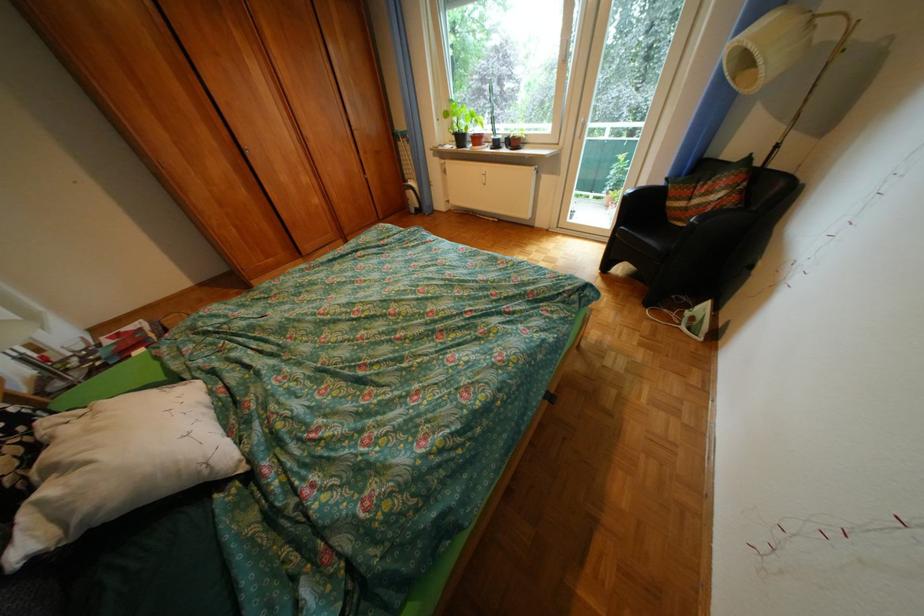
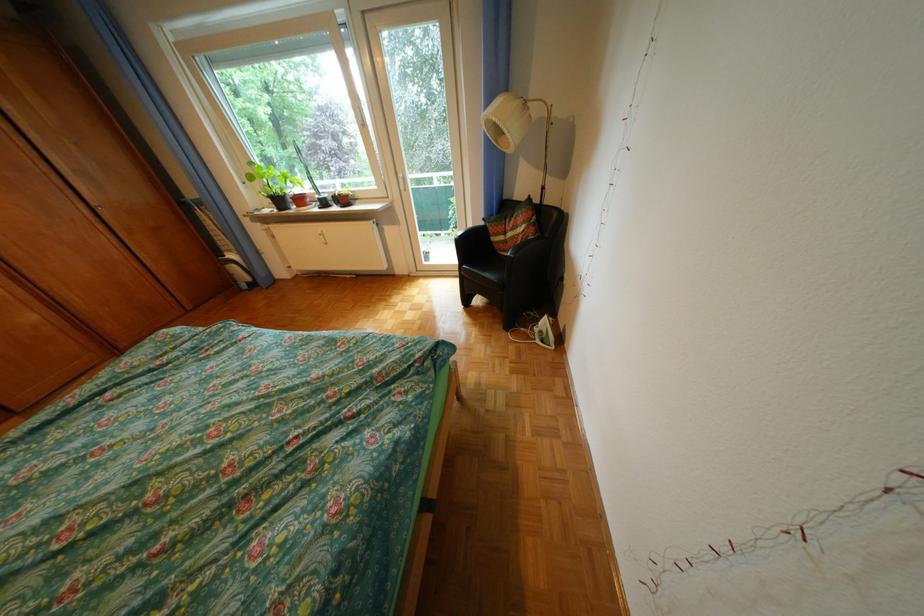
In the second image, find the point that corresponds to [369,129] in the first image.

(110, 205)